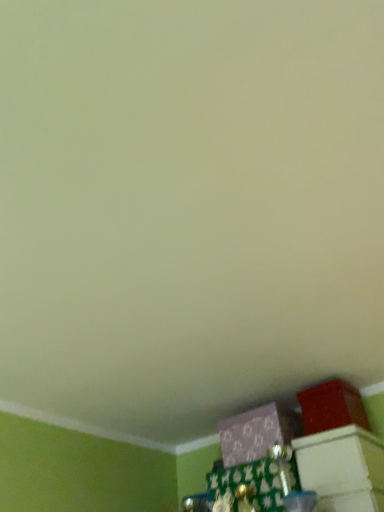
Question: Is purple matte box at lower center, the second box when ordered from right to left, further to camera compared to matte red box at lower right, arranged as the 2th box when viewed from the left?

Choices:
 (A) yes
 (B) no

Answer: (A)

Question: Considering the relative positions of purple matte box at lower center, the second box when ordered from right to left, and matte red box at lower right, arranged as the 2th box when viewed from the left, in the image provided, is purple matte box at lower center, the second box when ordered from right to left, to the left of matte red box at lower right, arranged as the 2th box when viewed from the left, from the viewer's perspective?

Choices:
 (A) no
 (B) yes

Answer: (B)

Question: Is matte red box at lower right, arranged as the 2th box when viewed from the left, surrounded by purple matte box at lower center, which ranks as the 1th box in left-to-right order?

Choices:
 (A) yes
 (B) no

Answer: (B)

Question: Is purple matte box at lower center, the second box when ordered from right to left, aimed at matte red box at lower right, arranged as the 2th box when viewed from the left?

Choices:
 (A) yes
 (B) no

Answer: (B)

Question: From a real-world perspective, is purple matte box at lower center, the second box when ordered from right to left, physically above matte red box at lower right, arranged as the 2th box when viewed from the left?

Choices:
 (A) no
 (B) yes

Answer: (A)

Question: From the image's perspective, would you say purple matte box at lower center, which ranks as the 1th box in left-to-right order, is positioned over matte red box at lower right, positioned as the 1th box in right-to-left order?

Choices:
 (A) yes
 (B) no

Answer: (B)

Question: Is matte red box at lower right, arranged as the 2th box when viewed from the left, wider than purple matte box at lower center, the second box when ordered from right to left?

Choices:
 (A) yes
 (B) no

Answer: (B)

Question: From the image's perspective, is matte red box at lower right, arranged as the 2th box when viewed from the left, below purple matte box at lower center, which ranks as the 1th box in left-to-right order?

Choices:
 (A) no
 (B) yes

Answer: (A)

Question: Does matte red box at lower right, positioned as the 1th box in right-to-left order, come behind purple matte box at lower center, the second box when ordered from right to left?

Choices:
 (A) yes
 (B) no

Answer: (B)

Question: Is matte red box at lower right, positioned as the 1th box in right-to-left order, to the right of purple matte box at lower center, which ranks as the 1th box in left-to-right order, from the viewer's perspective?

Choices:
 (A) yes
 (B) no

Answer: (A)

Question: From the image's perspective, is matte red box at lower right, positioned as the 1th box in right-to-left order, located above purple matte box at lower center, the second box when ordered from right to left?

Choices:
 (A) yes
 (B) no

Answer: (A)

Question: Does matte red box at lower right, positioned as the 1th box in right-to-left order, appear on the left side of purple matte box at lower center, which ranks as the 1th box in left-to-right order?

Choices:
 (A) yes
 (B) no

Answer: (B)

Question: Would you say matte red box at lower right, positioned as the 1th box in right-to-left order, is to the left or to the right of purple matte box at lower center, the second box when ordered from right to left, in the picture?

Choices:
 (A) right
 (B) left

Answer: (A)